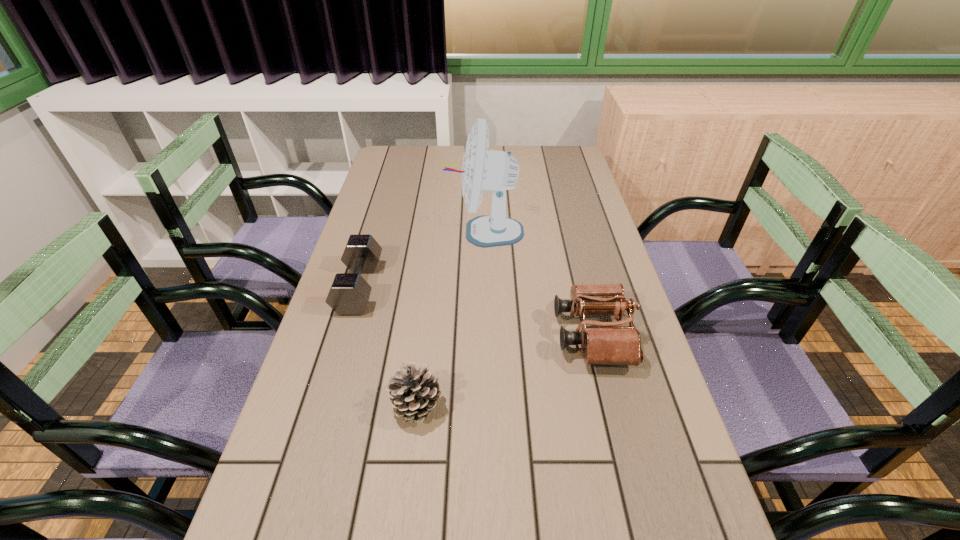
Identify the location of the tallest object. (495, 171).

Find the location of a particular element. the farthest object is located at coordinates (495, 171).

Where is `binoculars`? The image size is (960, 540). binoculars is located at coordinates (609, 344).

Locate an element on the screen. The image size is (960, 540). pinecone is located at coordinates (414, 393).

The width and height of the screenshot is (960, 540). Find the location of `the shortest object`. the shortest object is located at coordinates (349, 294).

The height and width of the screenshot is (540, 960). I want to click on the leftmost object, so click(x=349, y=294).

Where is `vacant point located 0.160m on the grille of the fan`? vacant point located 0.160m on the grille of the fan is located at coordinates (394, 232).

In order to click on free region located 0.210m on the grille of the fan in this screenshot , I will do `click(377, 232)`.

I want to click on free point located on the grille of the fan, so click(428, 232).

Locate an element on the screen. This screenshot has height=540, width=960. vacant area situated 0.400m through the eyepieces of the binoculars is located at coordinates (393, 335).